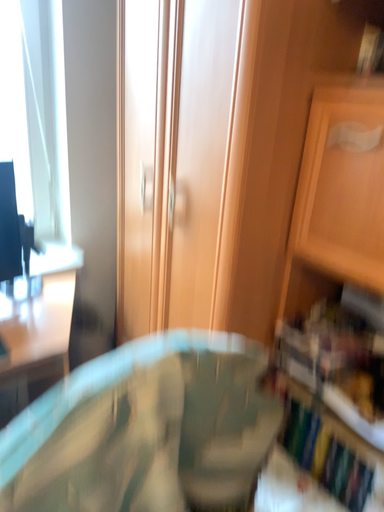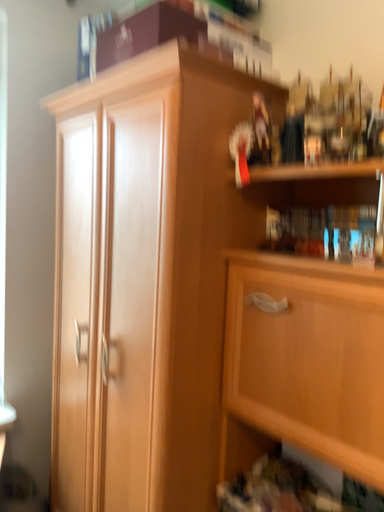
Question: Which way did the camera rotate in the video?

Choices:
 (A) rotated downward
 (B) rotated upward

Answer: (B)